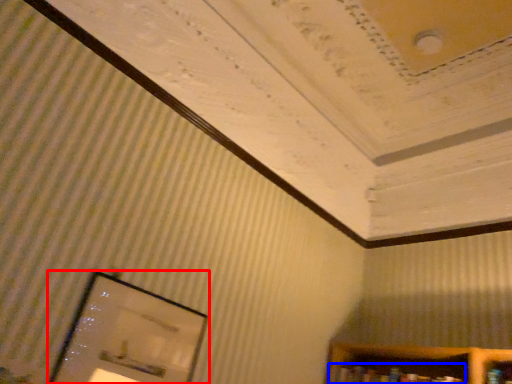
Question: Which object is further to the camera taking this photo, picture frame (highlighted by a red box) or book (highlighted by a blue box)?

Choices:
 (A) picture frame
 (B) book

Answer: (B)